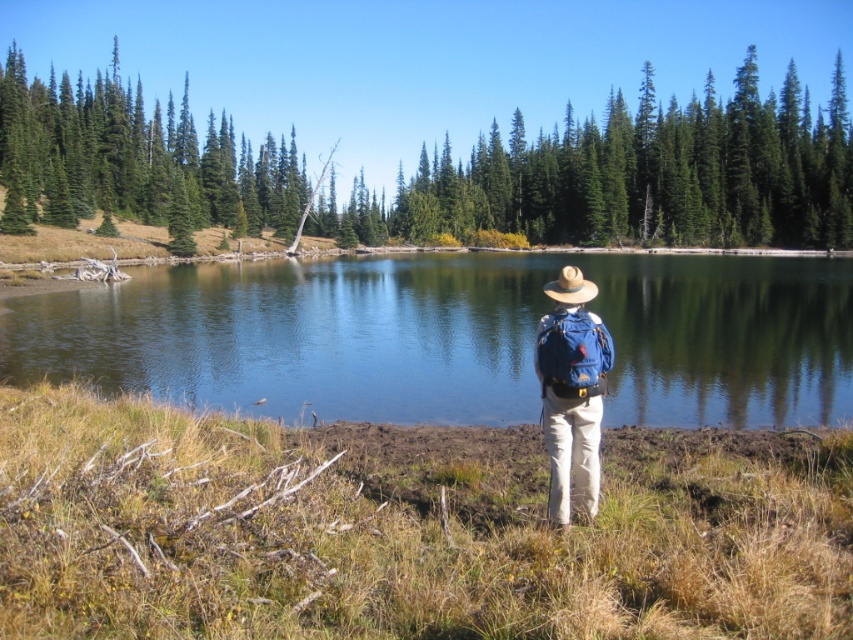
Is clear water at center shorter than brown straw cowboy hat at center?

No.

Which of these two, clear water at center or brown straw cowboy hat at center, stands taller?

With more height is clear water at center.

The width and height of the screenshot is (853, 640). What do you see at coordinates (453, 337) in the screenshot?
I see `clear water at center` at bounding box center [453, 337].

You are a GUI agent. You are given a task and a screenshot of the screen. Output one action in this format:
    pyautogui.click(x=<x>, y=<y>)
    Task: Click on the clear water at center
    Image resolution: width=853 pixels, height=640 pixels.
    Given the screenshot: What is the action you would take?
    [x=453, y=337]

Which of these two, blue fabric backpack at center or brown straw cowboy hat at center, stands taller?

brown straw cowboy hat at center

Which is behind, point (572, 291) or point (561, 292)?

The point (561, 292) is more distant.

Locate an element on the screen. This screenshot has width=853, height=640. blue fabric backpack at center is located at coordinates (572, 394).

Which is more to the left, clear water at center or blue fabric backpack at center?

Positioned to the left is blue fabric backpack at center.

What do you see at coordinates (453, 337) in the screenshot? This screenshot has width=853, height=640. I see `clear water at center` at bounding box center [453, 337].

Who is more distant from viewer, (692, 300) or (563, 524)?

Positioned behind is point (692, 300).

Identify the location of clear water at center. The width and height of the screenshot is (853, 640). (453, 337).